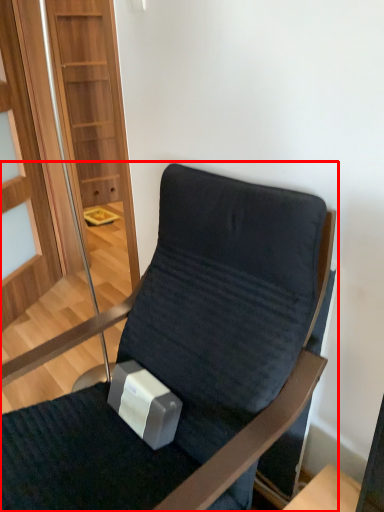
Question: In this image, where is chair (annotated by the red box) located relative to glass door?

Choices:
 (A) left
 (B) right

Answer: (B)